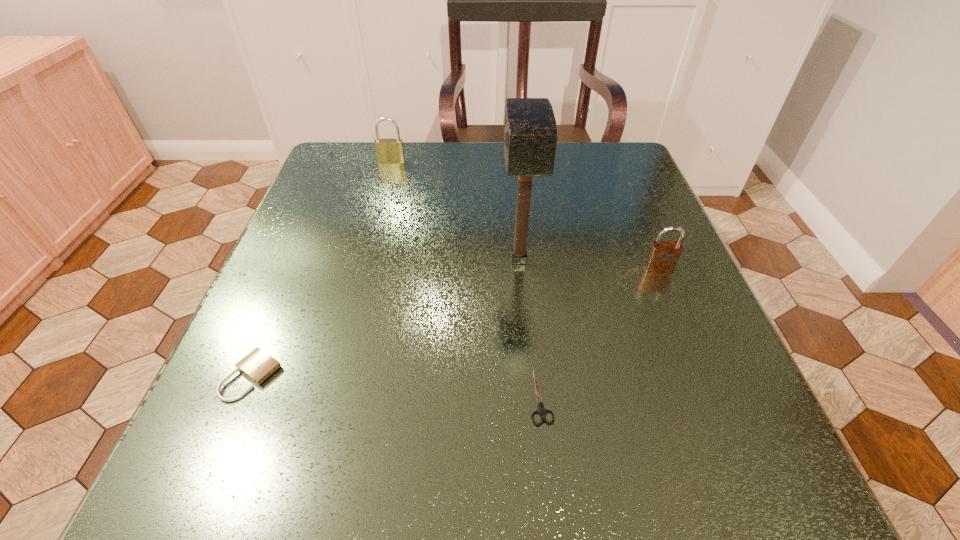
Select which object appears as the closest to the shortest object. Please provide its 2D coordinates. Your answer should be formatted as a tuple, i.e. [(x, y)], where the tuple contains the x and y coordinates of a point satisfying the conditions above.

[(530, 135)]

Select which object appears as the closest to the leftmost object. Please provide its 2D coordinates. Your answer should be formatted as a tuple, i.e. [(x, y)], where the tuple contains the x and y coordinates of a point satisfying the conditions above.

[(530, 135)]

Find the location of a particular element. This screenshot has width=960, height=540. the second closest padlock relative to the rightmost padlock is located at coordinates point(258,365).

This screenshot has height=540, width=960. I want to click on padlock that stands as the closest to the nearest padlock, so click(x=390, y=151).

Locate an element on the screen. vacant position in the image that satisfies the following two spatial constraints: 1. on the front-facing side of the farthest padlock; 2. on the left side of the shortest object is located at coordinates (327, 396).

At what (x,y) coordinates should I click in order to perform the action: click on vacant space that satisfies the following two spatial constraints: 1. on the front-facing side of the tallest object; 2. on the right side of the farthest object. Please return your answer as a coordinate pair (x, y). Image resolution: width=960 pixels, height=540 pixels. Looking at the image, I should click on (x=365, y=260).